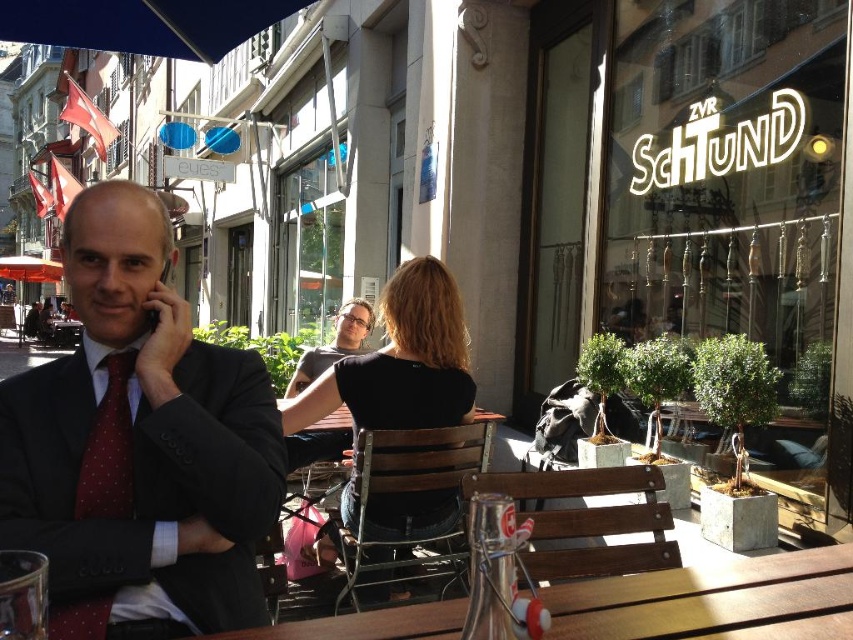
Does black fabric shirt at center have a lesser height compared to matte black shirt at center?

No, black fabric shirt at center is not shorter than matte black shirt at center.

Who is higher up, black fabric shirt at center or matte black shirt at center?

black fabric shirt at center is above.

The width and height of the screenshot is (853, 640). Describe the element at coordinates (401, 362) in the screenshot. I see `black fabric shirt at center` at that location.

The width and height of the screenshot is (853, 640). What are the coordinates of `black fabric shirt at center` in the screenshot? It's located at (401, 362).

Can you confirm if transparent glass table at center is thinner than matte black shirt at center?

In fact, transparent glass table at center might be wider than matte black shirt at center.

Measure the distance between transparent glass table at center and camera.

transparent glass table at center is 97.48 centimeters away from camera.

I want to click on transparent glass table at center, so [711, 600].

Is transparent glass table at center smaller than red dotted tie at left?

No, transparent glass table at center is not smaller than red dotted tie at left.

Locate an element on the screen. This screenshot has width=853, height=640. transparent glass table at center is located at coordinates (711, 600).